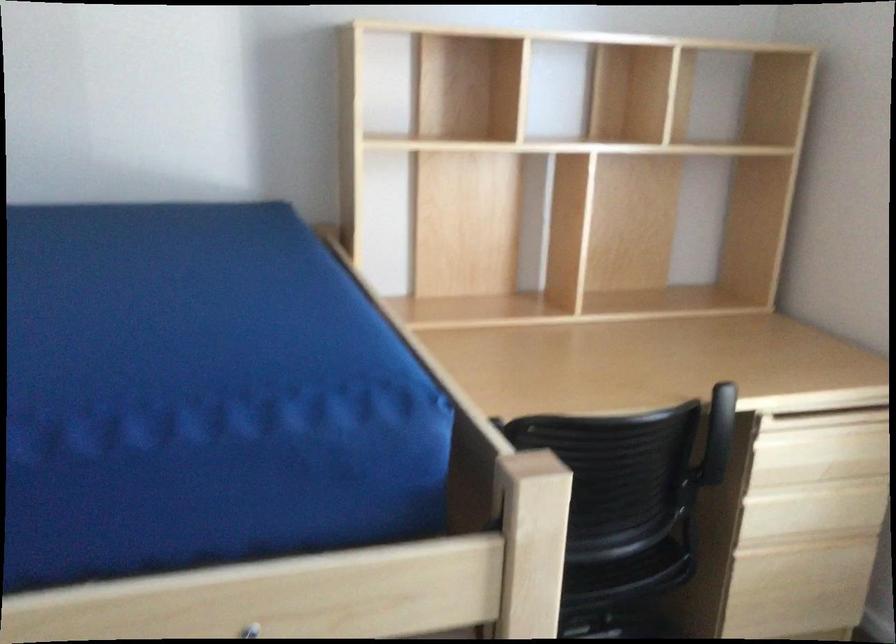
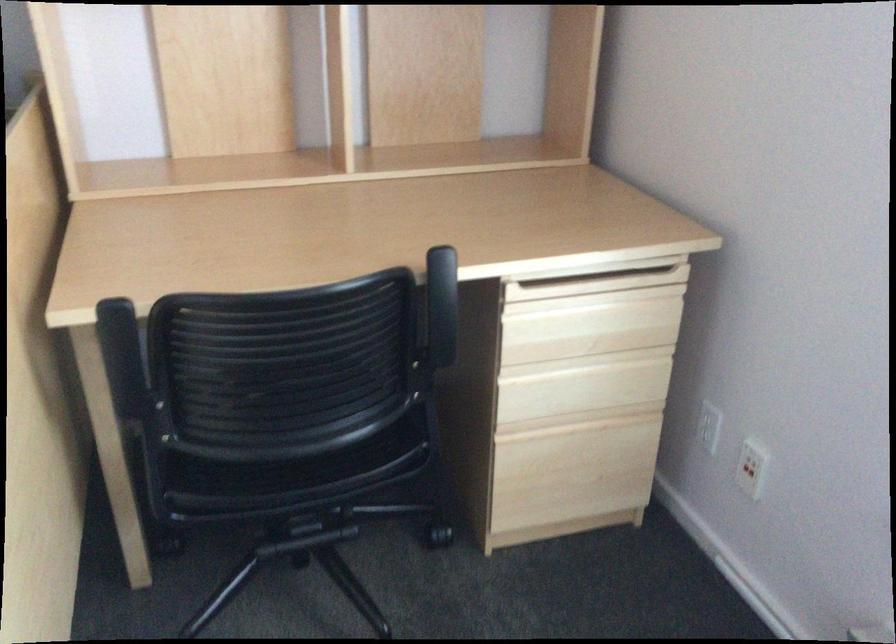
In the second image, find the point that corresponds to pixel 823 419 in the first image.

(587, 286)